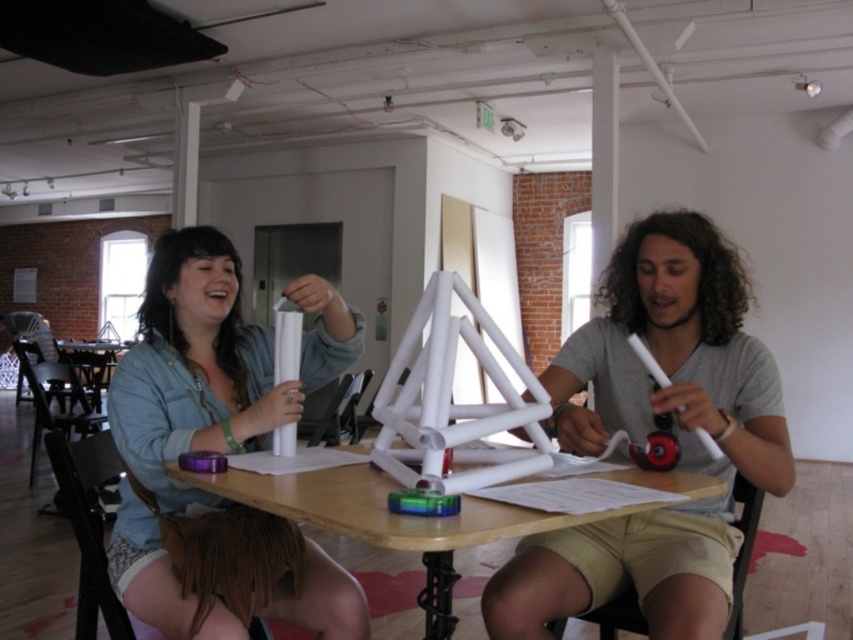
Based on the photo, you are standing at the origin of the coordinate system in the room. You see two points marked on the floor. The first point is at coordinates point (164, 237) and the second point is at point (689, 483). Which point is closer to you?

Point (164, 237) is behind point (689, 483), so the closer point to you is point (689, 483).

You are organizing a craft project and need to know the dimensions of the objects on the table. Which object, the matte white paper at center or the wooden table at center, has a greater height?

The matte white paper at center is taller than the wooden table at center.